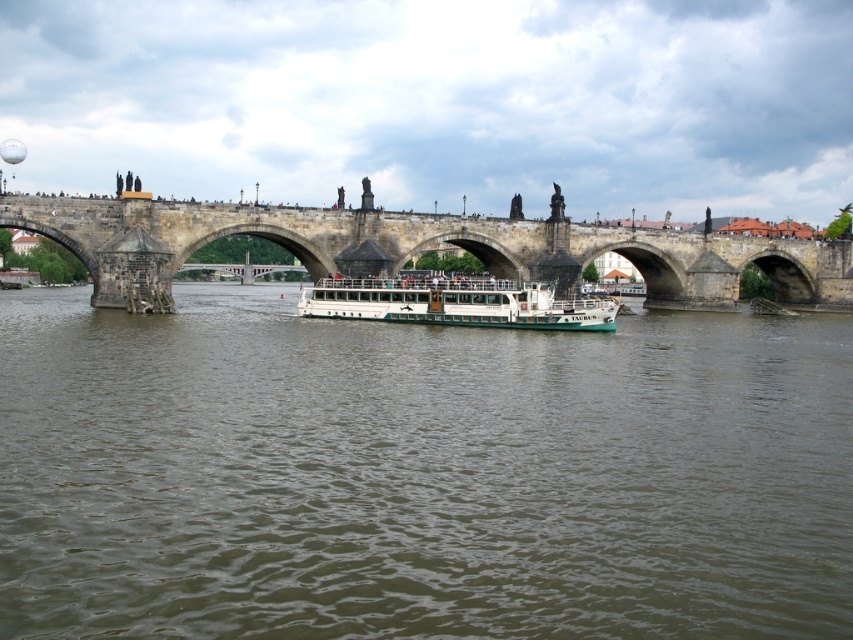
Which is more to the right, brown water at center or stone bridge at center?

From the viewer's perspective, stone bridge at center appears more on the right side.

Can you confirm if brown water at center is shorter than stone bridge at center?

No, brown water at center is not shorter than stone bridge at center.

What are the coordinates of `brown water at center` in the screenshot? It's located at (418, 474).

Which of these two, stone bridge at center or white matte boat at center, stands shorter?

white matte boat at center is shorter.

Is stone bridge at center closer to camera compared to white matte boat at center?

Yes, stone bridge at center is in front of white matte boat at center.

Is point (666, 282) farther from camera compared to point (428, 291)?

That is True.

The width and height of the screenshot is (853, 640). I want to click on stone bridge at center, so click(x=425, y=246).

Image resolution: width=853 pixels, height=640 pixels. What do you see at coordinates (418, 474) in the screenshot?
I see `brown water at center` at bounding box center [418, 474].

Who is lower down, brown water at center or white matte boat at center?

Positioned lower is brown water at center.

What do you see at coordinates (418, 474) in the screenshot? I see `brown water at center` at bounding box center [418, 474].

Locate an element on the screen. This screenshot has width=853, height=640. brown water at center is located at coordinates pos(418,474).